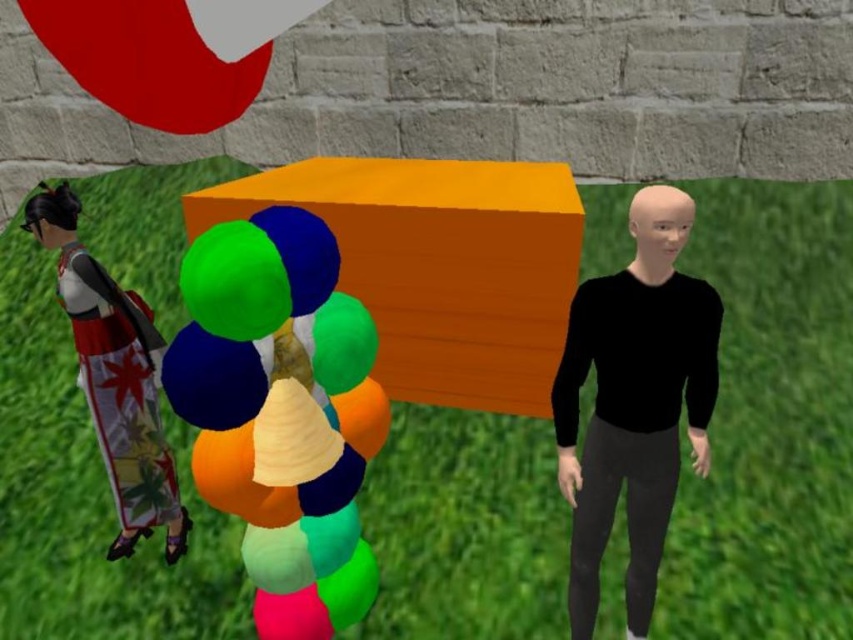
You are planning to hang the satin balloons at center and the silk kimono doll at left from a tree branch. Which object will hang lower?

The satin balloons at center has a lesser height compared to the silk kimono doll at left, so the satin balloons at center will hang lower.

You are standing at the origin point in the image. Which of the two points, point (358, 376) or point (608, 378), is closer to you?

Point (358, 376) is in front of point (608, 378), so it is closer to you.